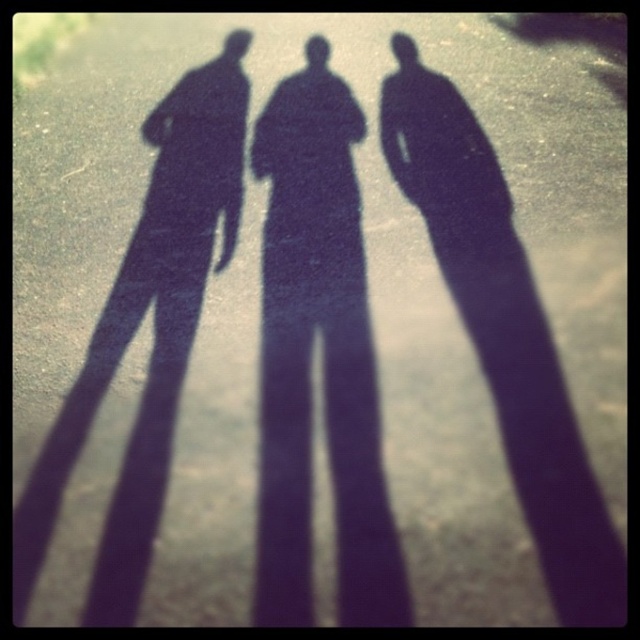
Does black matte figure at center have a larger size compared to black matte shadow of a person at center?

No, black matte figure at center is not bigger than black matte shadow of a person at center.

Who is more forward, (273, 442) or (516, 452)?

Point (516, 452) is in front.

The width and height of the screenshot is (640, 640). Find the location of `black matte figure at center`. black matte figure at center is located at coordinates (323, 358).

Can you confirm if black matte shadow of a person at center is positioned above black matte figure at left?

Indeed, black matte shadow of a person at center is positioned over black matte figure at left.

The image size is (640, 640). In order to click on black matte shadow of a person at center in this screenshot , I will do `click(502, 332)`.

Based on the photo, is black matte figure at center taller than black matte figure at left?

Incorrect, black matte figure at center's height is not larger of black matte figure at left's.

Can you confirm if black matte figure at center is bigger than black matte figure at left?

No, black matte figure at center is not bigger than black matte figure at left.

Is point (353, 442) positioned after point (234, 202)?

No.

Identify the location of black matte figure at center. tap(323, 358).